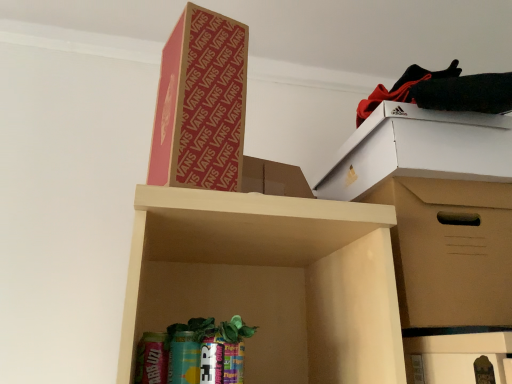
The image size is (512, 384). What do you see at coordinates (201, 104) in the screenshot?
I see `cardboard box at upper center, the 1th cardboard box from the left` at bounding box center [201, 104].

In the scene shown: Measure the distance between cardboard box at upper center, the second cardboard box when ordered from right to left, and camera.

The depth of cardboard box at upper center, the second cardboard box when ordered from right to left, is 24.37 inches.

The image size is (512, 384). In order to click on brown cardboard box at right, marked as the 2th cardboard box in a top-to-bottom arrangement in this screenshot , I will do pyautogui.click(x=437, y=208).

Image resolution: width=512 pixels, height=384 pixels. Find the location of `black fabric at upper right`. black fabric at upper right is located at coordinates (444, 91).

From the image's perspective, between cardboard box at upper center, which is the 2th cardboard box in bottom-to-top order, and black fabric at upper right, which one is located above?

black fabric at upper right appears higher in the image.

Could you tell me if cardboard box at upper center, the 1th cardboard box from the left, is turned towards black fabric at upper right?

No, cardboard box at upper center, the 1th cardboard box from the left, is not facing towards black fabric at upper right.

Is cardboard box at upper center, the second cardboard box when ordered from right to left, positioned far away from black fabric at upper right?

No, cardboard box at upper center, the second cardboard box when ordered from right to left, is in close proximity to black fabric at upper right.

Consider the image. Is cardboard box at upper center, the second cardboard box when ordered from right to left, bigger or smaller than black fabric at upper right?

cardboard box at upper center, the second cardboard box when ordered from right to left, is bigger than black fabric at upper right.

Can you tell me how much cardboard box at upper center, which is the 2th cardboard box in bottom-to-top order, and brown cardboard box at right, the first cardboard box when ordered from bottom to top, differ in facing direction?

cardboard box at upper center, which is the 2th cardboard box in bottom-to-top order, and brown cardboard box at right, the first cardboard box when ordered from bottom to top, are facing 18.6 degrees away from each other.

From the image's perspective, does cardboard box at upper center, the 1th cardboard box from the left, appear lower than brown cardboard box at right, the first cardboard box when ordered from bottom to top?

Actually, cardboard box at upper center, the 1th cardboard box from the left, appears above brown cardboard box at right, the first cardboard box when ordered from bottom to top, in the image.

Are cardboard box at upper center, positioned as the 1th cardboard box in top-to-bottom order, and brown cardboard box at right, arranged as the first cardboard box when viewed from the right, beside each other?

cardboard box at upper center, positioned as the 1th cardboard box in top-to-bottom order, and brown cardboard box at right, arranged as the first cardboard box when viewed from the right, are not in contact.

Could you tell me if cardboard box at upper center, the second cardboard box when ordered from right to left, is turned towards brown cardboard box at right, the first cardboard box when ordered from bottom to top?

No, cardboard box at upper center, the second cardboard box when ordered from right to left, is not turned towards brown cardboard box at right, the first cardboard box when ordered from bottom to top.

Is black fabric at upper right placed right next to cardboard box at upper center, the second cardboard box when ordered from right to left?

No, black fabric at upper right is not making contact with cardboard box at upper center, the second cardboard box when ordered from right to left.

Is black fabric at upper right facing towards cardboard box at upper center, the 1th cardboard box from the left?

No, black fabric at upper right is not oriented towards cardboard box at upper center, the 1th cardboard box from the left.

You are a GUI agent. You are given a task and a screenshot of the screen. Output one action in this format:
    pyautogui.click(x=<x>, y=<y>)
    Task: Click on the clothing that is on the right side of cardboard box at upper center, which is the 2th cardboard box in bottom-to-top order
    The width and height of the screenshot is (512, 384).
    Given the screenshot: What is the action you would take?
    pyautogui.click(x=444, y=91)

From the image's perspective, is black fabric at upper right located above or below brown cardboard box at right, the 2th cardboard box in the left-to-right sequence?

From the image's perspective, black fabric at upper right appears above brown cardboard box at right, the 2th cardboard box in the left-to-right sequence.

Which of these two, black fabric at upper right or brown cardboard box at right, the 2th cardboard box in the left-to-right sequence, stands shorter?

With less height is black fabric at upper right.

Which object is further away from the camera, black fabric at upper right or brown cardboard box at right, arranged as the first cardboard box when viewed from the right?

black fabric at upper right is behind.

Is black fabric at upper right outside of brown cardboard box at right, the first cardboard box when ordered from bottom to top?

Absolutely, black fabric at upper right is external to brown cardboard box at right, the first cardboard box when ordered from bottom to top.

From a real-world perspective, who is located lower, brown cardboard box at right, arranged as the first cardboard box when viewed from the right, or cardboard box at upper center, the second cardboard box when ordered from right to left?

From a 3D spatial view, brown cardboard box at right, arranged as the first cardboard box when viewed from the right, is below.

Does brown cardboard box at right, marked as the 2th cardboard box in a top-to-bottom arrangement, turn towards cardboard box at upper center, the 1th cardboard box from the left?

No, brown cardboard box at right, marked as the 2th cardboard box in a top-to-bottom arrangement, does not turn towards cardboard box at upper center, the 1th cardboard box from the left.

In the scene shown: Is brown cardboard box at right, marked as the 2th cardboard box in a top-to-bottom arrangement, spatially inside cardboard box at upper center, which is the 2th cardboard box in bottom-to-top order, or outside of it?

brown cardboard box at right, marked as the 2th cardboard box in a top-to-bottom arrangement, is located beyond the bounds of cardboard box at upper center, which is the 2th cardboard box in bottom-to-top order.

Which point is more distant from viewer, (398, 250) or (191, 143)?

The point (398, 250) is behind.

Is brown cardboard box at right, the first cardboard box when ordered from bottom to top, aimed at black fabric at upper right?

No.

Does point (408, 141) lie behind point (362, 113)?

No, (408, 141) is in front of (362, 113).

Is brown cardboard box at right, the 2th cardboard box in the left-to-right sequence, at the left side of black fabric at upper right?

Yes, brown cardboard box at right, the 2th cardboard box in the left-to-right sequence, is to the left of black fabric at upper right.

The width and height of the screenshot is (512, 384). I want to click on cardboard box that is the 1st one below the black fabric at upper right (from a real-world perspective), so click(x=201, y=104).

The image size is (512, 384). Identify the location of cardboard box below the cardboard box at upper center, positioned as the 1th cardboard box in top-to-bottom order (from the image's perspective). (437, 208).

Which object lies further to the anchor point brown cardboard box at right, the 2th cardboard box in the left-to-right sequence, black fabric at upper right or cardboard box at upper center, the second cardboard box when ordered from right to left?

cardboard box at upper center, the second cardboard box when ordered from right to left, lies further to brown cardboard box at right, the 2th cardboard box in the left-to-right sequence, than the other object.

From the image, which object appears to be farther from black fabric at upper right, cardboard box at upper center, the second cardboard box when ordered from right to left, or brown cardboard box at right, the 2th cardboard box in the left-to-right sequence?

cardboard box at upper center, the second cardboard box when ordered from right to left, is positioned further to the anchor black fabric at upper right.

Looking at the image, which one is located further to black fabric at upper right, brown cardboard box at right, marked as the 2th cardboard box in a top-to-bottom arrangement, or cardboard box at upper center, the second cardboard box when ordered from right to left?

Among the two, cardboard box at upper center, the second cardboard box when ordered from right to left, is located further to black fabric at upper right.

Estimate the real-world distances between objects in this image. Which object is closer to cardboard box at upper center, the second cardboard box when ordered from right to left, brown cardboard box at right, marked as the 2th cardboard box in a top-to-bottom arrangement, or black fabric at upper right?

Among the two, black fabric at upper right is located nearer to cardboard box at upper center, the second cardboard box when ordered from right to left.

Based on their spatial positions, is cardboard box at upper center, the 1th cardboard box from the left, or black fabric at upper right closer to brown cardboard box at right, marked as the 2th cardboard box in a top-to-bottom arrangement?

black fabric at upper right.

From the image, which object appears to be nearer to cardboard box at upper center, which is the 2th cardboard box in bottom-to-top order, black fabric at upper right or brown cardboard box at right, arranged as the first cardboard box when viewed from the right?

The object closer to cardboard box at upper center, which is the 2th cardboard box in bottom-to-top order, is black fabric at upper right.

This screenshot has width=512, height=384. What are the coordinates of `cardboard box between cardboard box at upper center, positioned as the 1th cardboard box in top-to-bottom order, and black fabric at upper right from left to right` in the screenshot? It's located at (437, 208).